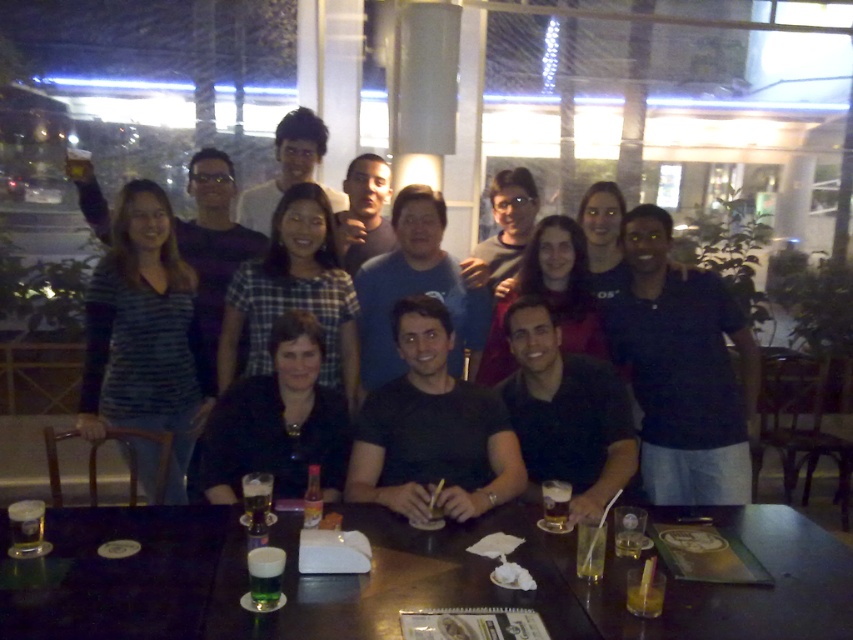
Which is behind, point (721, 636) or point (136, 268)?

Point (136, 268)

The height and width of the screenshot is (640, 853). What do you see at coordinates (410, 580) in the screenshot?
I see `shiny dark wood table at center` at bounding box center [410, 580].

Where is `shiny dark wood table at center`? Image resolution: width=853 pixels, height=640 pixels. shiny dark wood table at center is located at coordinates pos(410,580).

Where is `shiny dark wood table at center`? shiny dark wood table at center is located at coordinates (410, 580).

Can you confirm if translucent glass beer at table center is positioned to the right of translucent glass drink at table center?

In fact, translucent glass beer at table center is to the left of translucent glass drink at table center.

Can you confirm if translucent glass beer at table center is smaller than translucent glass drink at table center?

No.

Is point (544, 488) less distant than point (659, 609)?

No, (544, 488) is further to viewer.

Find the location of `translucent glass beer at table center`. translucent glass beer at table center is located at coordinates (555, 504).

Does point (260, 403) come behind point (273, 595)?

Yes, point (260, 403) is farther from viewer.

The image size is (853, 640). Describe the element at coordinates (277, 420) in the screenshot. I see `black matte shirt at center` at that location.

Between point (317, 330) and point (252, 579), which one is positioned in front?

Point (252, 579) is in front.

Locate an element on the screen. The width and height of the screenshot is (853, 640). black matte shirt at center is located at coordinates (277, 420).